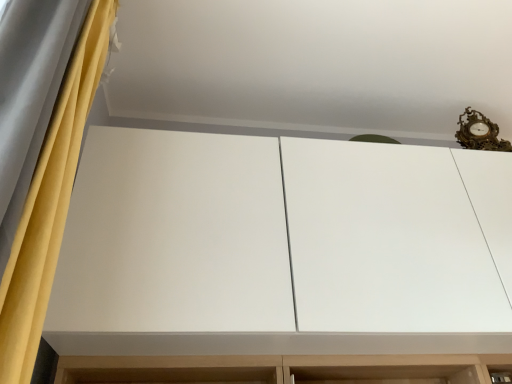
This screenshot has height=384, width=512. Describe the element at coordinates (175, 236) in the screenshot. I see `white matte cabinet at center` at that location.

I want to click on white matte cabinet at center, so point(175,236).

Identify the location of white matte cabinet at center. (175, 236).